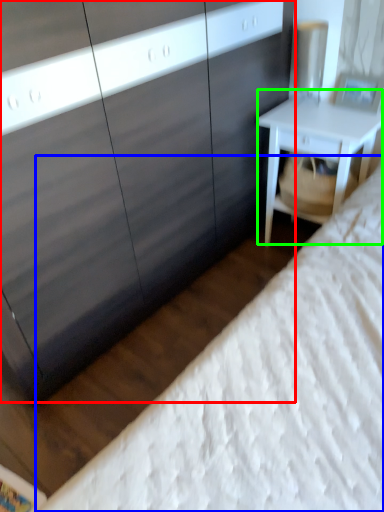
Question: Which object is the farthest from dresser (highlighted by a red box)? Choose among these: bed (highlighted by a blue box) or nightstand (highlighted by a green box).

Choices:
 (A) bed
 (B) nightstand

Answer: (A)